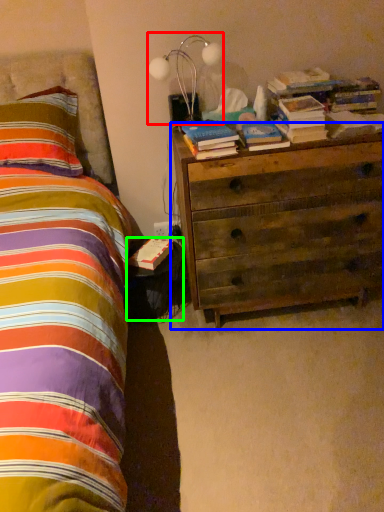
Question: Which is farther away from lamp (highlighted by a red box)? chest of drawers (highlighted by a blue box) or nightstand (highlighted by a green box)?

Choices:
 (A) chest of drawers
 (B) nightstand

Answer: (B)